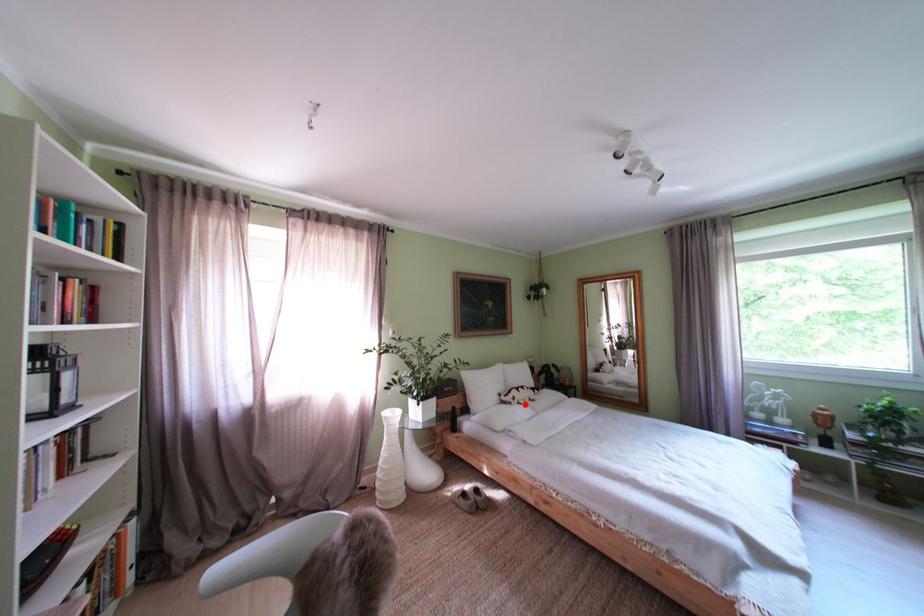
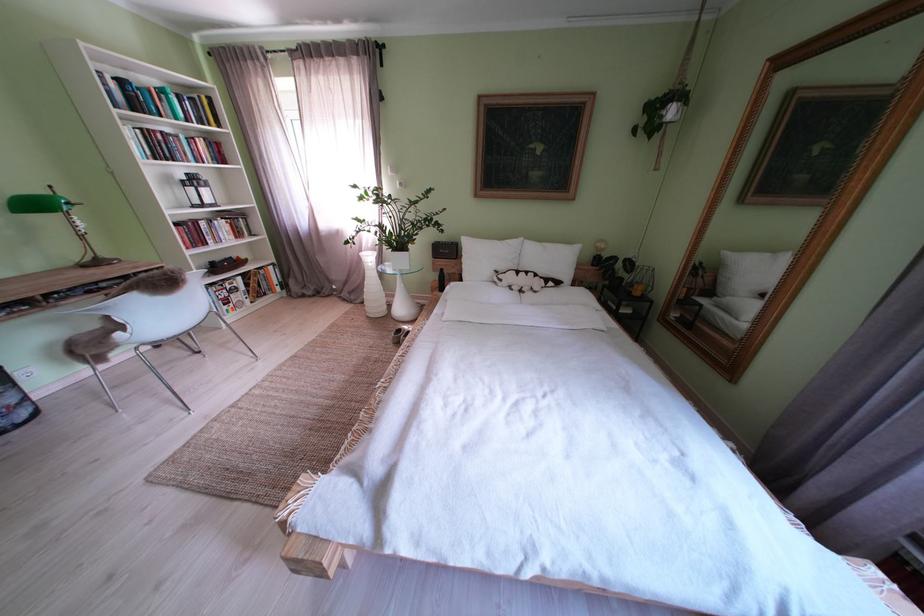
Question: I am providing you with two images of the same scene from different viewpoints. A red point is shown in image1. For the corresponding object point in image2, is it positioned nearer or farther from the camera?

Choices:
 (A) Nearer
 (B) Farther

Answer: (A)